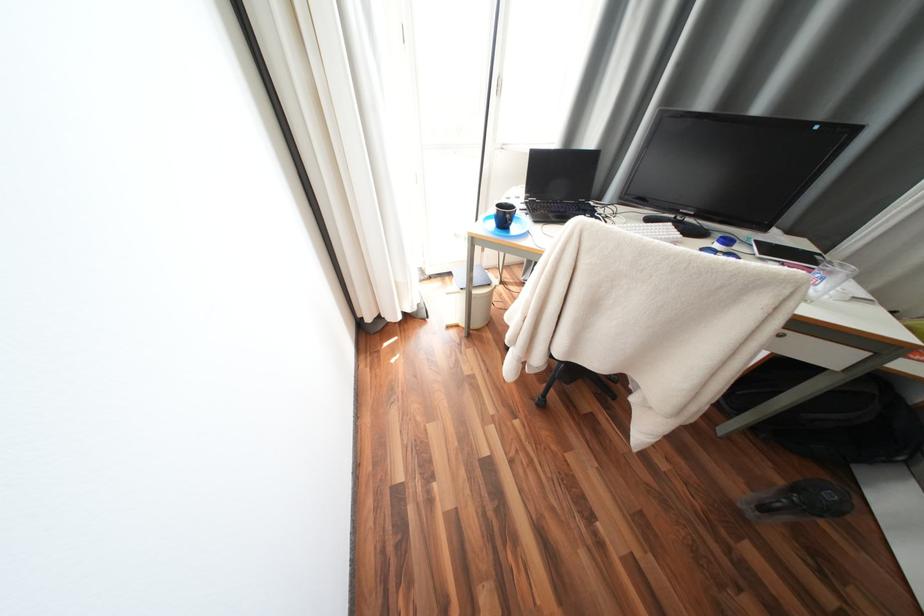
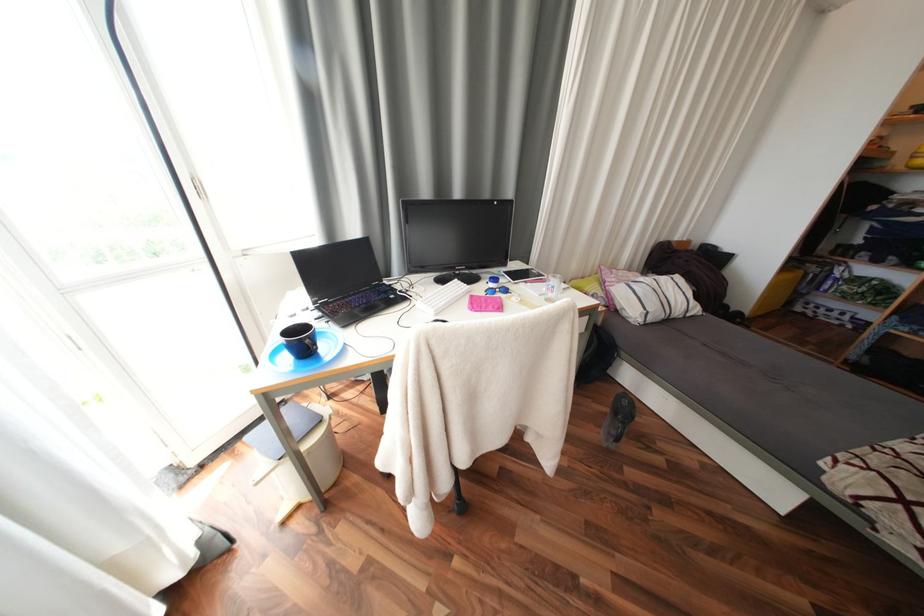
Question: The images are taken continuously from a first-person perspective. In which direction is your viewpoint rotating?

Choices:
 (A) Left
 (B) Right
 (C) Up
 (D) Down

Answer: (B)